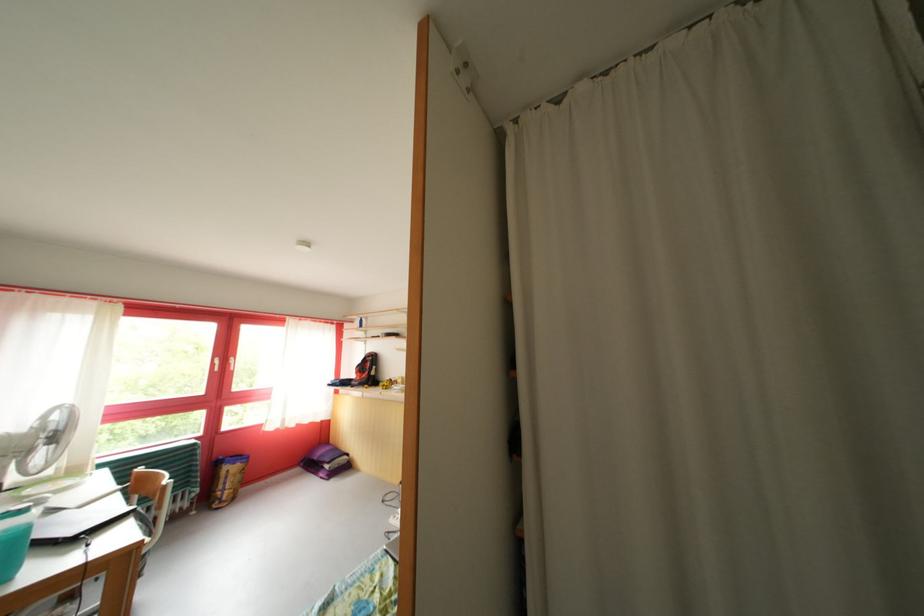
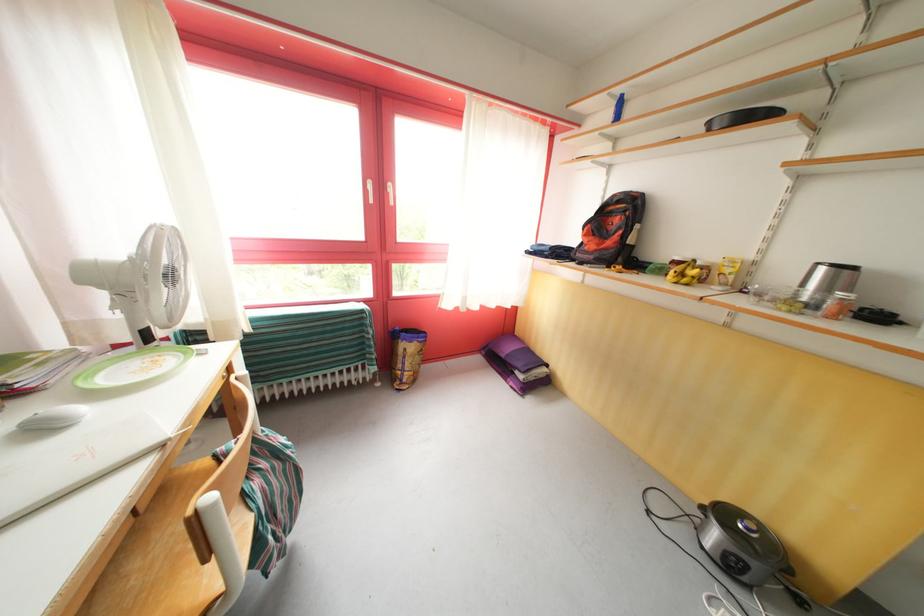
The point at (360, 379) is marked in the first image. Where is the corresponding point in the second image?

(580, 245)